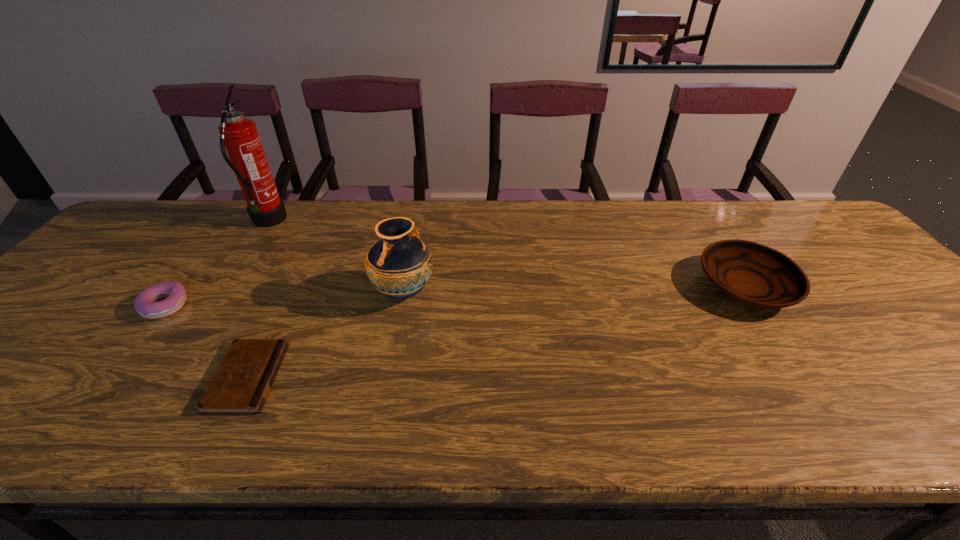
At what (x,y) coordinates should I click in order to perform the action: click on free space that satisfies the following two spatial constraints: 1. on the back side of the plate; 2. on the left side of the second tallest object. Please return your answer as a coordinate pair (x, y). Looking at the image, I should click on (405, 286).

Where is `free space that satisfies the following two spatial constraints: 1. on the back side of the third tallest object; 2. on the left side of the fourth object from left to right`? Image resolution: width=960 pixels, height=540 pixels. free space that satisfies the following two spatial constraints: 1. on the back side of the third tallest object; 2. on the left side of the fourth object from left to right is located at coordinates (405, 286).